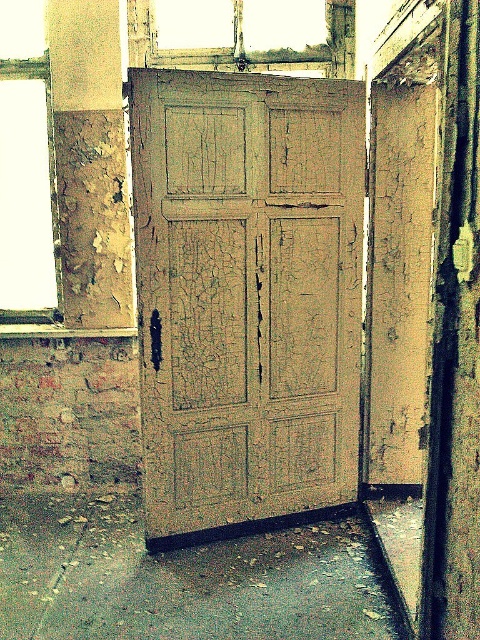
Question: Is transparent glass window at upper left to the right of wooden frame at upper center from the viewer's perspective?

Choices:
 (A) no
 (B) yes

Answer: (A)

Question: Estimate the real-world distances between objects in this image. Which object is closer to the wooden frame at upper center?

Choices:
 (A) transparent glass window at upper left
 (B) cracked wood door at center

Answer: (A)

Question: Based on their relative distances, which object is farther from the cracked wood door at center?

Choices:
 (A) transparent glass window at upper left
 (B) wooden frame at upper center

Answer: (B)

Question: Does cracked wood door at center appear over transparent glass window at upper left?

Choices:
 (A) yes
 (B) no

Answer: (B)

Question: Which of the following is the farthest from the observer?

Choices:
 (A) (294, 60)
 (B) (183, 70)
 (C) (58, 244)

Answer: (A)

Question: Is cracked wood door at center thinner than wooden frame at upper center?

Choices:
 (A) yes
 (B) no

Answer: (A)